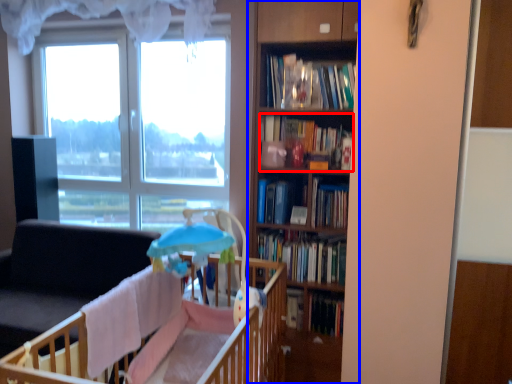
Question: Which object appears closest to the camera in this image, book (highlighted by a red box) or bookcase (highlighted by a blue box)?

Choices:
 (A) book
 (B) bookcase

Answer: (B)